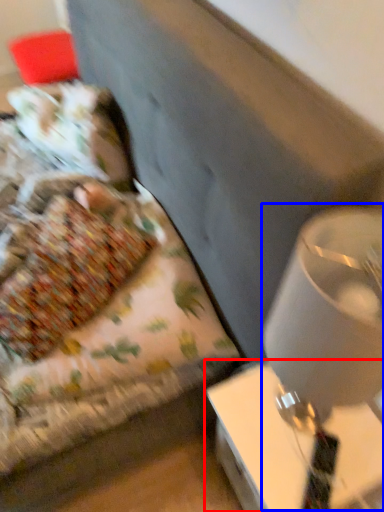
Question: Which object is closer to the camera taking this photo, table (highlighted by a red box) or table lamp (highlighted by a blue box)?

Choices:
 (A) table
 (B) table lamp

Answer: (B)